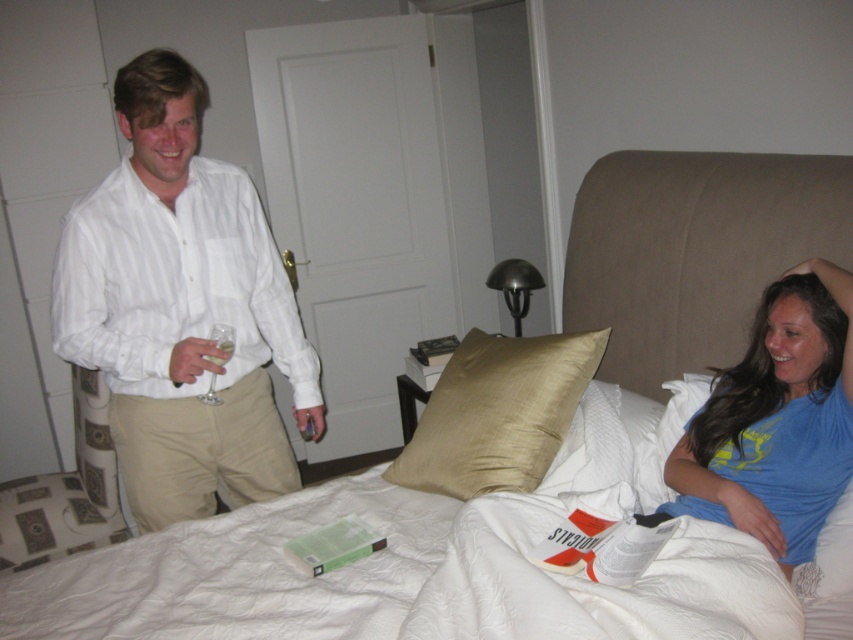
You are standing in the bedroom and want to place a small decorative item between the two points marked as point (300, 433) and point (833, 337). Which point should the item be closer to in order to be nearer to the viewer?

The item should be closer to point (300, 433) because it is closer to the viewer than point (833, 337).

You are designing a storage box that needs to accommodate both the silky gold pillow at center and the khaki cotton pants at left. Based on their widths, which item requires a wider compartment?

The silky gold pillow at center requires a wider compartment because its width surpasses that of the khaki cotton pants at left.

You are organizing a photoshoot and need to ensure that the silky gold pillow at center and the khaki cotton pants at left are visible in the frame. Based on their positions, which object is covering part of the other?

The silky gold pillow at center is positioned over the khaki cotton pants at left, so it is covering part of the khaki cotton pants at left.